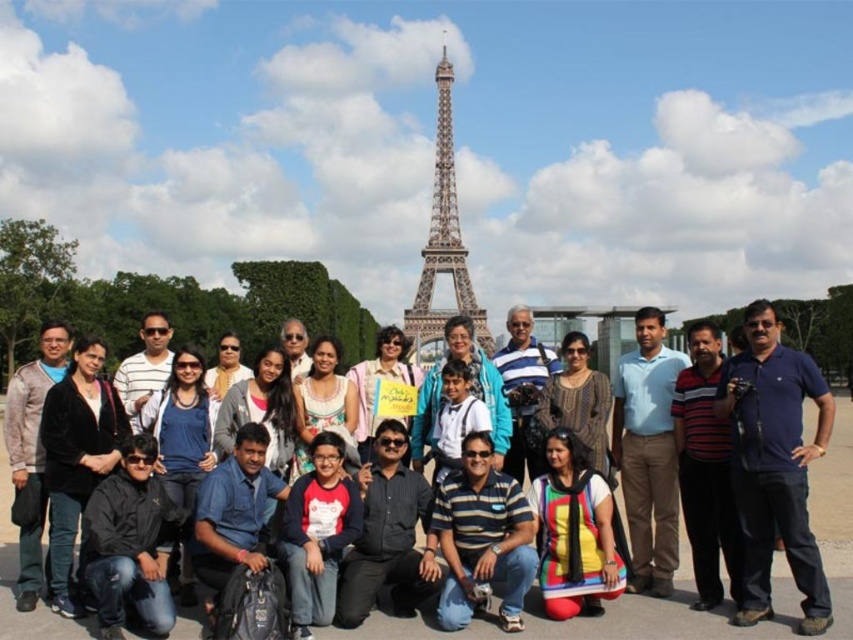
Question: Is blue cotton shirt at right bigger than dark blue shirt at center?

Choices:
 (A) no
 (B) yes

Answer: (B)

Question: Which is nearer to the black velvet jacket at lower left?

Choices:
 (A) matte white shirt at center
 (B) multicolored fabric at center
 (C) matte pink shirt at center
 (D) blue cotton shirt at right

Answer: (A)

Question: Which object is closer to the camera taking this photo?

Choices:
 (A) black fabric jacket at center
 (B) matte pink shirt at center
 (C) painted steel eiffel tower at center

Answer: (C)

Question: Is striped cotton shirt at center further to camera compared to blue shirt at center?

Choices:
 (A) yes
 (B) no

Answer: (B)

Question: Is matte blue shirt at center above blue shirt at center?

Choices:
 (A) yes
 (B) no

Answer: (A)

Question: Which point appears farthest from the camera in this image?

Choices:
 (A) (299, 570)
 (B) (496, 444)
 (C) (759, 307)

Answer: (C)